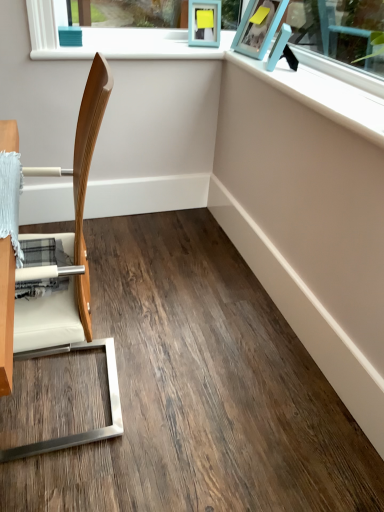
Question: Can you confirm if blue plastic picture frame at upper right, the 2th picture frame positioned from the right, is positioned to the right of matte blue picture frame at upper right, marked as the first picture frame in a right-to-left arrangement?

Choices:
 (A) yes
 (B) no

Answer: (B)

Question: Does blue plastic picture frame at upper right, the 2th picture frame positioned from the right, have a larger size compared to matte blue picture frame at upper right, marked as the third picture frame in a left-to-right arrangement?

Choices:
 (A) yes
 (B) no

Answer: (A)

Question: From the image's perspective, would you say blue plastic picture frame at upper right, the 2th picture frame positioned from the right, is positioned over matte blue picture frame at upper right, marked as the third picture frame in a left-to-right arrangement?

Choices:
 (A) yes
 (B) no

Answer: (A)

Question: From the image's perspective, does blue plastic picture frame at upper right, the 2th picture frame positioned from the right, appear lower than matte blue picture frame at upper right, marked as the first picture frame in a right-to-left arrangement?

Choices:
 (A) yes
 (B) no

Answer: (B)

Question: Does blue plastic picture frame at upper right, the second picture frame in the left-to-right sequence, have a greater height compared to matte blue picture frame at upper right, marked as the first picture frame in a right-to-left arrangement?

Choices:
 (A) yes
 (B) no

Answer: (A)

Question: Choose the correct answer: Is teal matte picture frame at upper center, which is the 3th picture frame in right-to-left order, inside matte blue picture frame at upper right, marked as the first picture frame in a right-to-left arrangement, or outside it?

Choices:
 (A) outside
 (B) inside

Answer: (A)

Question: Based on their sizes in the image, would you say teal matte picture frame at upper center, the first picture frame when ordered from left to right, is bigger or smaller than matte blue picture frame at upper right, marked as the first picture frame in a right-to-left arrangement?

Choices:
 (A) big
 (B) small

Answer: (A)

Question: Is point (195, 1) closer or farther from the camera than point (281, 54)?

Choices:
 (A) farther
 (B) closer

Answer: (A)

Question: Considering the relative positions of teal matte picture frame at upper center, the first picture frame when ordered from left to right, and matte blue picture frame at upper right, marked as the first picture frame in a right-to-left arrangement, in the image provided, is teal matte picture frame at upper center, the first picture frame when ordered from left to right, to the left or to the right of matte blue picture frame at upper right, marked as the first picture frame in a right-to-left arrangement,?

Choices:
 (A) right
 (B) left

Answer: (B)

Question: Based on their positions, is matte blue picture frame at upper right, marked as the third picture frame in a left-to-right arrangement, located to the left or right of teal matte picture frame at upper center, the first picture frame when ordered from left to right?

Choices:
 (A) right
 (B) left

Answer: (A)

Question: From their relative heights in the image, would you say matte blue picture frame at upper right, marked as the first picture frame in a right-to-left arrangement, is taller or shorter than teal matte picture frame at upper center, which is the 3th picture frame in right-to-left order?

Choices:
 (A) tall
 (B) short

Answer: (B)

Question: Based on their sizes in the image, would you say matte blue picture frame at upper right, marked as the first picture frame in a right-to-left arrangement, is bigger or smaller than teal matte picture frame at upper center, the first picture frame when ordered from left to right?

Choices:
 (A) big
 (B) small

Answer: (B)

Question: Considering their positions, is matte blue picture frame at upper right, marked as the first picture frame in a right-to-left arrangement, located in front of or behind teal matte picture frame at upper center, the first picture frame when ordered from left to right?

Choices:
 (A) front
 (B) behind

Answer: (A)

Question: Is blue plastic picture frame at upper right, the 2th picture frame positioned from the right, bigger or smaller than wooden chair at left?

Choices:
 (A) small
 (B) big

Answer: (A)

Question: Would you say blue plastic picture frame at upper right, the 2th picture frame positioned from the right, is to the left or to the right of wooden chair at left in the picture?

Choices:
 (A) right
 (B) left

Answer: (A)